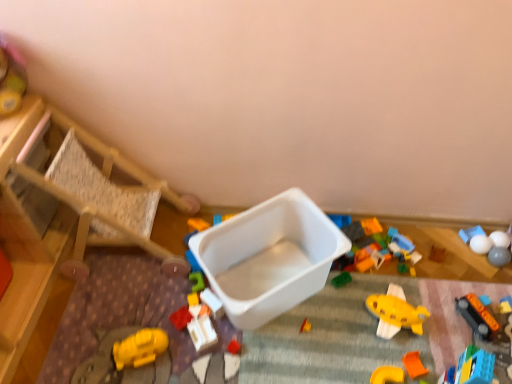
Where is `vacant space that is in between rubberized plastic toy at center, which ranks as the 2th toy in left-to-right order, and orange matte block at lower right, arranged as the eighth toy when viewed from the left`? vacant space that is in between rubberized plastic toy at center, which ranks as the 2th toy in left-to-right order, and orange matte block at lower right, arranged as the eighth toy when viewed from the left is located at coordinates (317, 351).